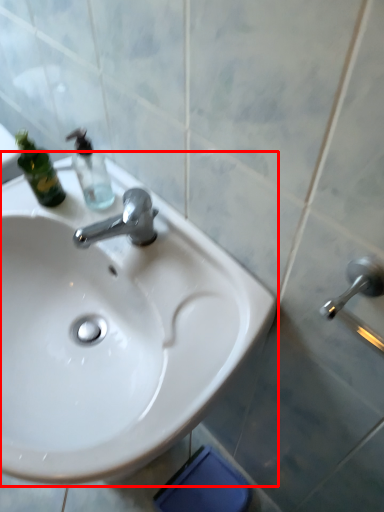
Question: From the image's perspective, considering the relative positions of sink (annotated by the red box) and bottle in the image provided, where is sink (annotated by the red box) located with respect to the staircase?

Choices:
 (A) below
 (B) above

Answer: (A)